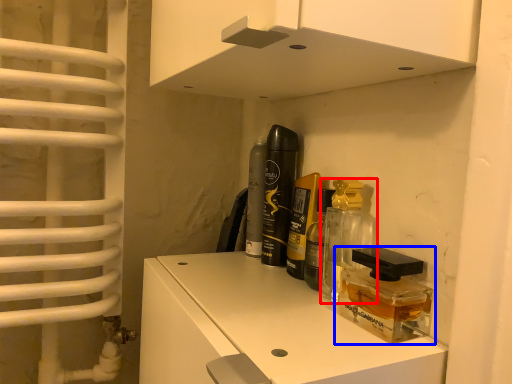
Question: Which object appears farthest to the camera in this image, perfume (highlighted by a red box) or product (highlighted by a blue box)?

Choices:
 (A) perfume
 (B) product

Answer: (A)